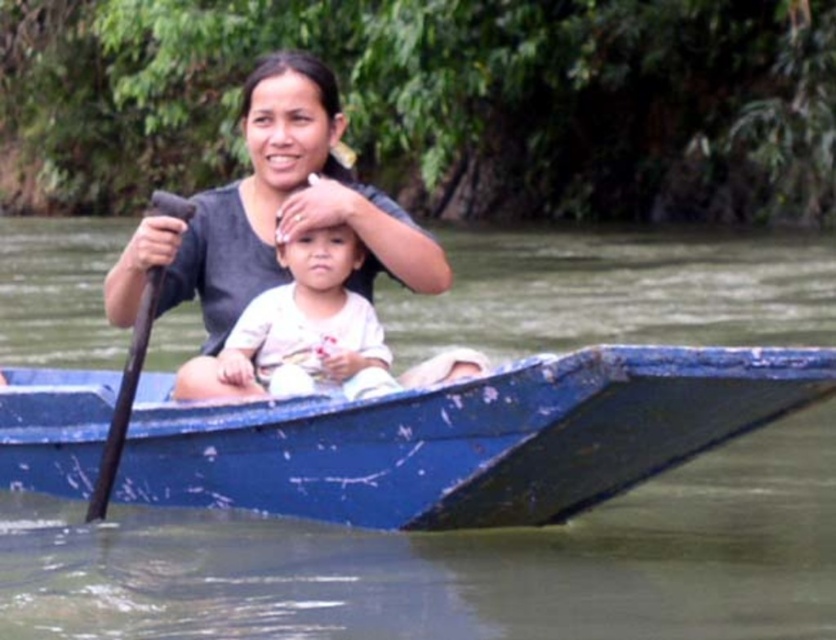
You are standing on the boat and want to reach both the point at coordinates point (279, 342) and point (177, 198). Which point should you reach first to minimize the distance traveled?

You should reach point (279, 342) first because it is closer to you than point (177, 198), so it requires less distance to travel.

You are standing on the dock and want to throw a lifebuoy to the point at coordinates point (x=278, y=304). The lifebuoy can travel 30 meters. Will it reach the point?

The distance between point (x=278, y=304) and the viewer is 29.11 meters, so yes, the lifebuoy can reach the point as it is within the 30 meters range.

You are a photographer trying to capture a candid shot of the white cotton baby at center and the dark brown wooden paddle at left. Since you want to ensure both subjects are in the frame, can you determine if they are positioned side by side or one in front of the other?

The white cotton baby at center is to the right of the dark brown wooden paddle at left, so they are positioned side by side in the frame.